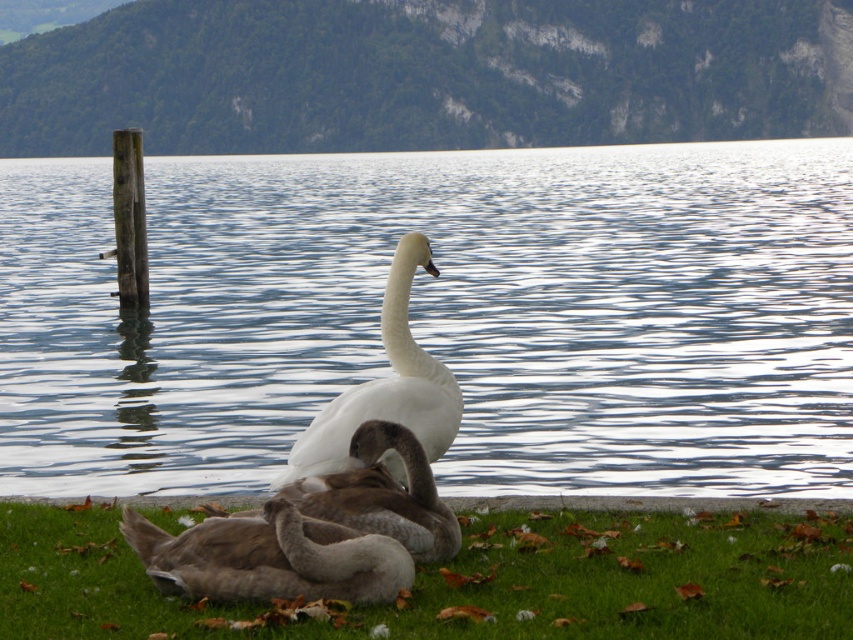
Does transparent water at center lie behind white glossy swan at center?

That is True.

Does transparent water at center appear under white glossy swan at center?

Incorrect, transparent water at center is not positioned below white glossy swan at center.

Is point (189, 248) in front of point (294, 449)?

No.

Find the location of a particular element. The width and height of the screenshot is (853, 640). transparent water at center is located at coordinates (442, 316).

Find the location of `brown soft grass at lower center`. brown soft grass at lower center is located at coordinates (469, 580).

Between brown soft grass at lower center and brown fuzzy duck at lower center, which one has less height?

brown soft grass at lower center is shorter.

Image resolution: width=853 pixels, height=640 pixels. Find the location of `brown soft grass at lower center`. brown soft grass at lower center is located at coordinates (469, 580).

Can you confirm if transparent water at center is thinner than brown fuzzy duck at lower center?

In fact, transparent water at center might be wider than brown fuzzy duck at lower center.

Can you confirm if transparent water at center is bigger than brown fuzzy duck at lower center?

Correct, transparent water at center is larger in size than brown fuzzy duck at lower center.

Describe the element at coordinates (442, 316) in the screenshot. This screenshot has width=853, height=640. I see `transparent water at center` at that location.

At what (x,y) coordinates should I click in order to perform the action: click on transparent water at center. Please return your answer as a coordinate pair (x, y). The width and height of the screenshot is (853, 640). Looking at the image, I should click on (442, 316).